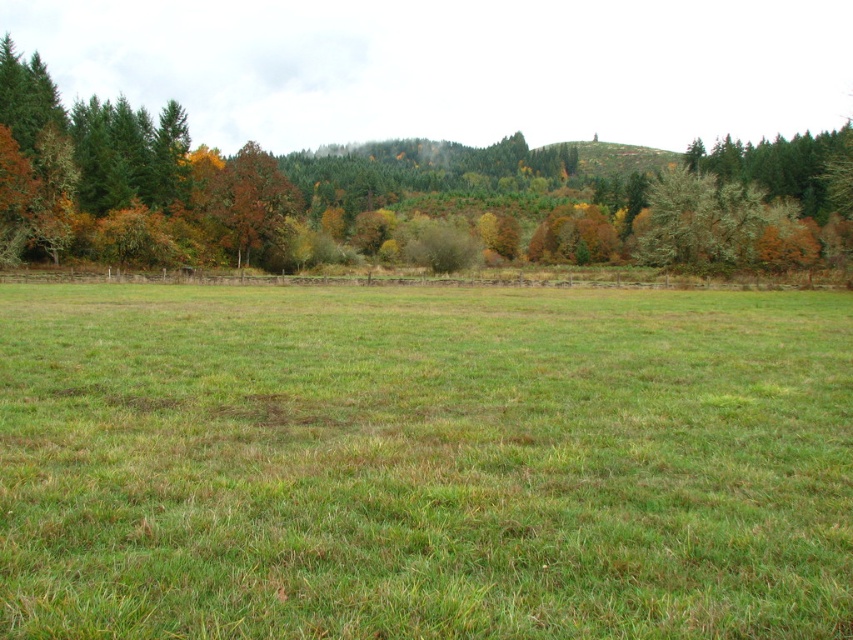
You are standing in the middle of the green grass pasture at center and want to walk towards the green leafy tree at center. Which direction should you walk to reach the tree?

The green grass pasture at center is positioned on the left side of the green leafy tree at center, so you should walk to the right to reach the tree.